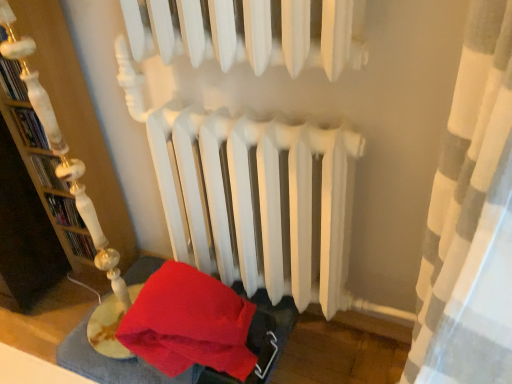
Question: From the image's perspective, is velvet red blanket at lower left located above or below wooden bookshelf at left?

Choices:
 (A) below
 (B) above

Answer: (A)

Question: Would you say velvet red blanket at lower left is to the left or to the right of wooden bookshelf at left in the picture?

Choices:
 (A) right
 (B) left

Answer: (A)

Question: Is velvet red blanket at lower left wider or thinner than wooden bookshelf at left?

Choices:
 (A) wide
 (B) thin

Answer: (A)

Question: Relative to velvet red blanket at lower left, is wooden bookshelf at left in front or behind?

Choices:
 (A) front
 (B) behind

Answer: (A)

Question: Is wooden bookshelf at left situated inside velvet red blanket at lower left or outside?

Choices:
 (A) inside
 (B) outside

Answer: (B)

Question: Based on their positions, is wooden bookshelf at left located to the left or right of velvet red blanket at lower left?

Choices:
 (A) left
 (B) right

Answer: (A)

Question: In terms of width, does wooden bookshelf at left look wider or thinner when compared to velvet red blanket at lower left?

Choices:
 (A) wide
 (B) thin

Answer: (B)